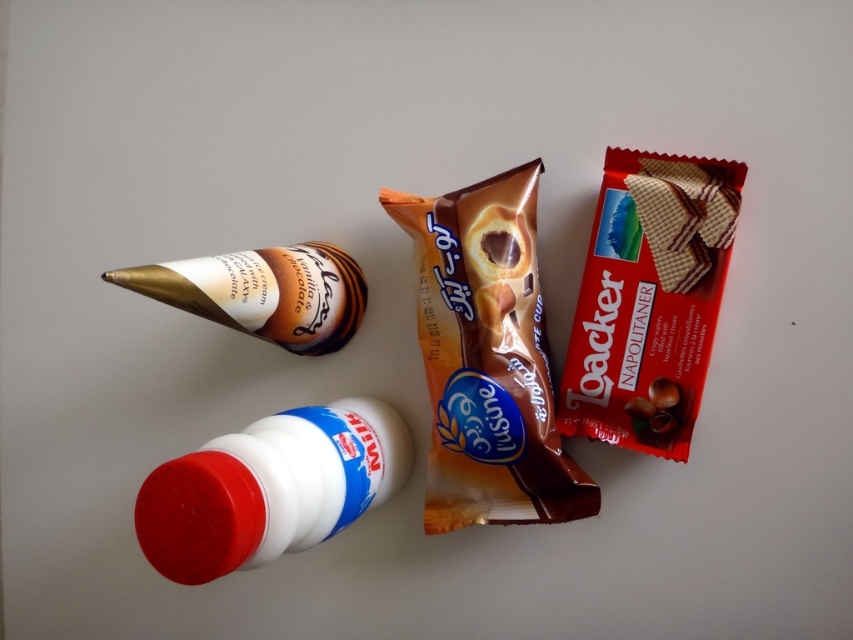
How distant is matte brown coffee cup at center from matte chocolate wafer at center right?

matte brown coffee cup at center is 10.21 inches from matte chocolate wafer at center right.

Looking at this image, is matte brown coffee cup at center positioned behind matte chocolate wafer at center right?

Yes.

Between point (473, 337) and point (682, 240), which one is positioned in front?

Positioned in front is point (682, 240).

This screenshot has height=640, width=853. I want to click on matte brown coffee cup at center, so point(486,358).

Is point (451, 195) closer to camera compared to point (315, 253)?

Yes, point (451, 195) is in front of point (315, 253).

The width and height of the screenshot is (853, 640). In order to click on matte brown coffee cup at center in this screenshot , I will do `click(486, 358)`.

In order to click on matte brown coffee cup at center in this screenshot , I will do `click(486, 358)`.

Which is behind, point (674, 262) or point (651, 227)?

The point (651, 227) is more distant.

Does matte red wafer at right have a lesser height compared to matte chocolate wafer at center right?

In fact, matte red wafer at right may be taller than matte chocolate wafer at center right.

The width and height of the screenshot is (853, 640). Find the location of `matte red wafer at right`. matte red wafer at right is located at coordinates (648, 300).